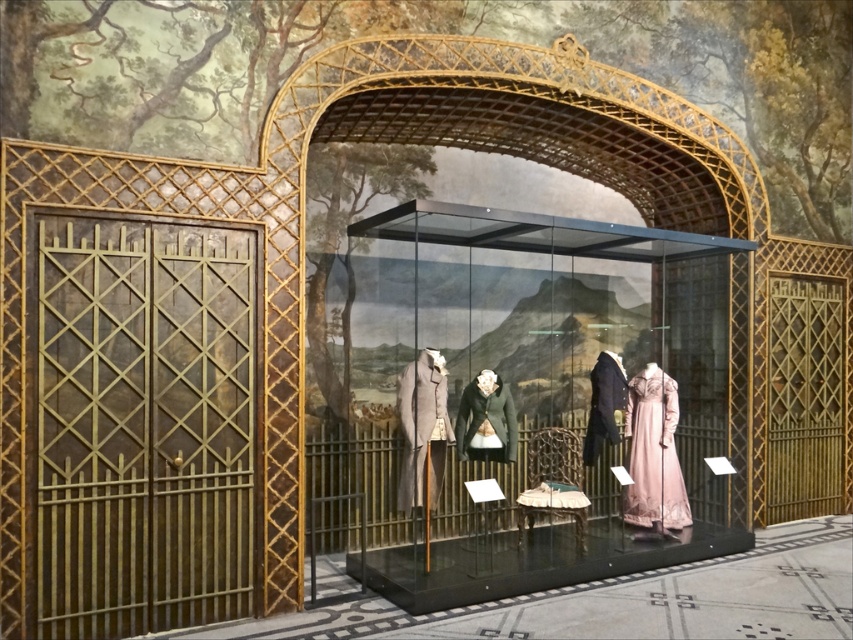
Question: Among these objects, which one is nearest to the camera?

Choices:
 (A) dark blue wool suit at center
 (B) gold textured gate at left
 (C) light gray wool coat at center

Answer: (B)

Question: Based on their relative distances, which object is farther from the gold textured gate at left?

Choices:
 (A) light gray wool coat at center
 (B) transparent glass box at center

Answer: (B)

Question: Is gold textured gate at left wider than light gray wool coat at center?

Choices:
 (A) no
 (B) yes

Answer: (B)

Question: Which object appears closest to the camera in this image?

Choices:
 (A) gold textured gate at left
 (B) green wool coat at center
 (C) light gray wool coat at center

Answer: (A)

Question: Does gold textured gate at left appear over light gray wool coat at center?

Choices:
 (A) no
 (B) yes

Answer: (B)

Question: Can you confirm if transparent glass box at center is positioned to the right of light gray wool coat at center?

Choices:
 (A) no
 (B) yes

Answer: (B)